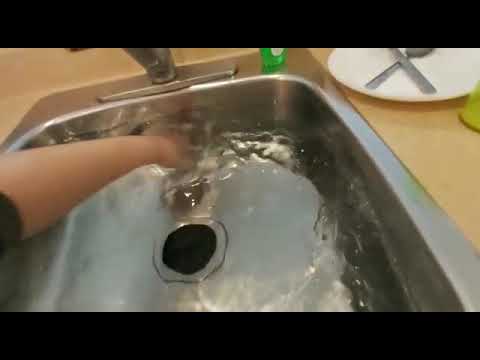
Locate an element on the screen. spoon is located at coordinates (387, 70).